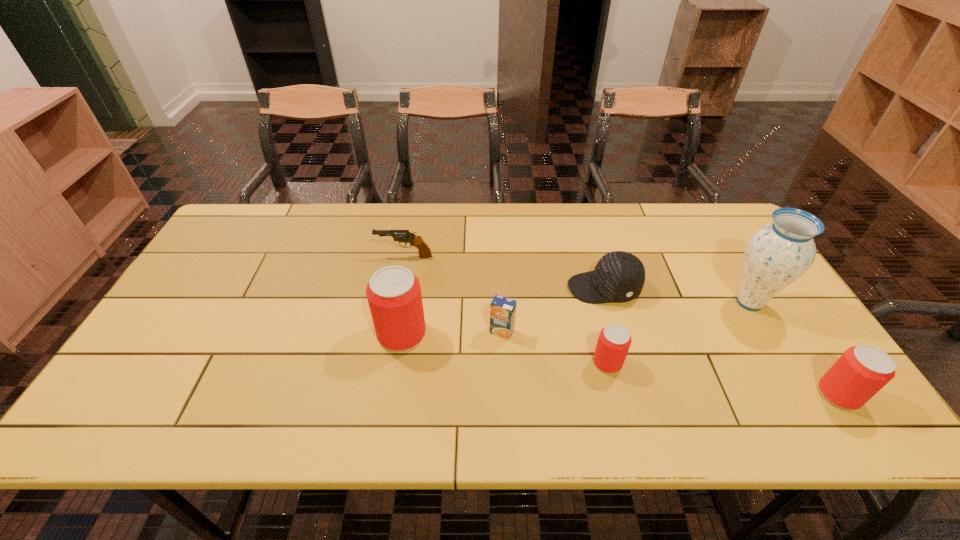
Find the location of a particular element. The image size is (960, 540). free space between the nearest object and the shortest beer can is located at coordinates (723, 379).

What are the coordinates of `unoccupied position between the vase and the baseball cap` in the screenshot? It's located at (677, 295).

The width and height of the screenshot is (960, 540). Find the location of `object that ranks as the fifth closest to the vase`. object that ranks as the fifth closest to the vase is located at coordinates 394,296.

At what (x,y) coordinates should I click in order to perform the action: click on the second closest object relative to the tallest object. Please return your answer as a coordinate pair (x, y). The height and width of the screenshot is (540, 960). Looking at the image, I should click on 619,276.

The height and width of the screenshot is (540, 960). What are the coordinates of `beer can that is the second closest to the third tallest object` in the screenshot? It's located at (394, 296).

Locate which beer can ranks in proximity to the orange_juice. Please provide its 2D coordinates. Your answer should be formatted as a tuple, i.e. [(x, y)], where the tuple contains the x and y coordinates of a point satisfying the conditions above.

[(394, 296)]

Where is `free space that satisfies the following two spatial constraints: 1. at the front of the baseball cap where the brim is located; 2. on the front side of the fifth object from right to left`? This screenshot has height=540, width=960. free space that satisfies the following two spatial constraints: 1. at the front of the baseball cap where the brim is located; 2. on the front side of the fifth object from right to left is located at coordinates [x=616, y=332].

Locate an element on the screen. This screenshot has width=960, height=540. vacant space that satisfies the following two spatial constraints: 1. at the front of the baseball cap where the brim is located; 2. on the right side of the nearest object is located at coordinates (634, 394).

This screenshot has width=960, height=540. Identify the location of free space that satisfies the following two spatial constraints: 1. on the front side of the orange_juice; 2. on the left side of the nearest object. (505, 394).

Image resolution: width=960 pixels, height=540 pixels. Find the location of `vacant region that satisfies the following two spatial constraints: 1. on the back side of the tallest beer can; 2. on the right side of the tallest object`. vacant region that satisfies the following two spatial constraints: 1. on the back side of the tallest beer can; 2. on the right side of the tallest object is located at coordinates (407, 302).